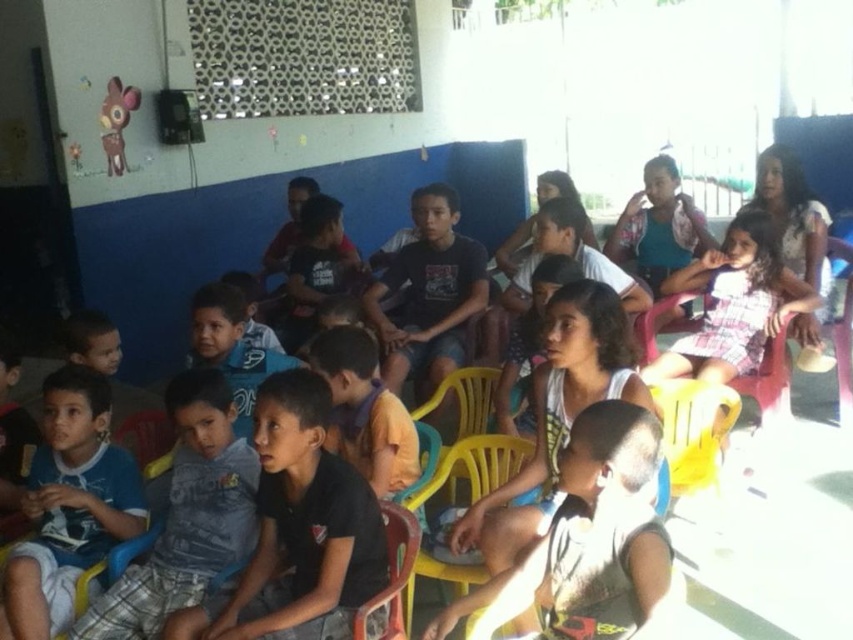
Is point (82, 490) more distant than point (393, 628)?

Yes, it is.

Between point (44, 531) and point (392, 612), which one is positioned behind?

Point (44, 531)

At what (x,y) coordinates should I click in order to perform the action: click on blue cotton shirt at lower left. Please return your answer as a coordinate pair (x, y). Looking at the image, I should click on (68, 504).